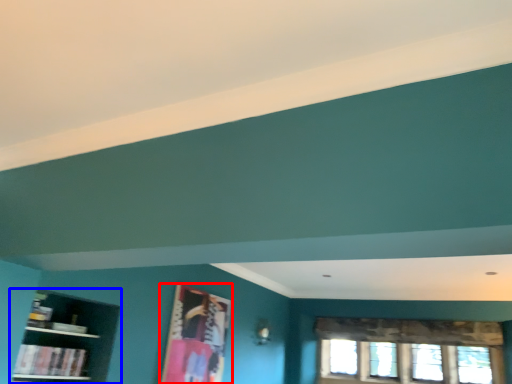
Question: Which of the following is the farthest to the observer, picture frame (highlighted by a red box) or shelf (highlighted by a blue box)?

Choices:
 (A) picture frame
 (B) shelf

Answer: (A)